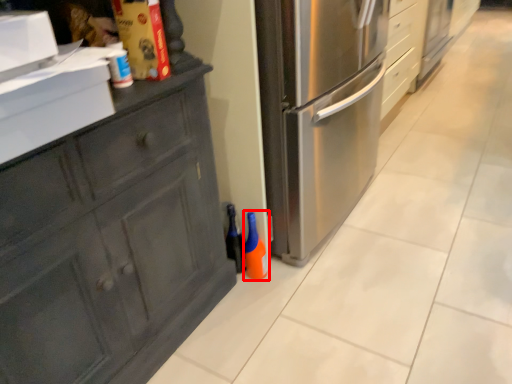
Question: In this image, where is bottle (annotated by the red box) located relative to bottle?

Choices:
 (A) left
 (B) right

Answer: (B)